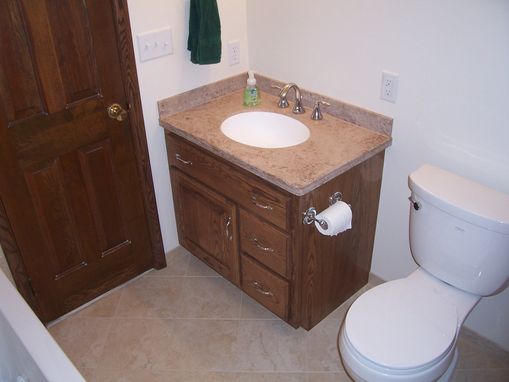
You are a GUI agent. You are given a task and a screenshot of the screen. Output one action in this format:
    pyautogui.click(x=<x>, y=<y>)
    Task: Click on the outlets
    The height and width of the screenshot is (382, 509).
    Given the screenshot: What is the action you would take?
    pyautogui.click(x=390, y=89), pyautogui.click(x=235, y=56)